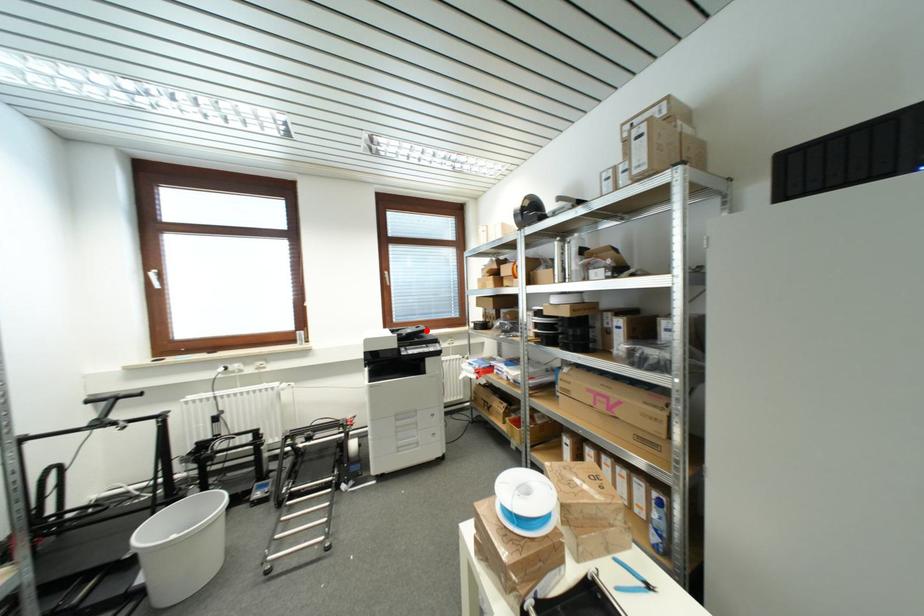
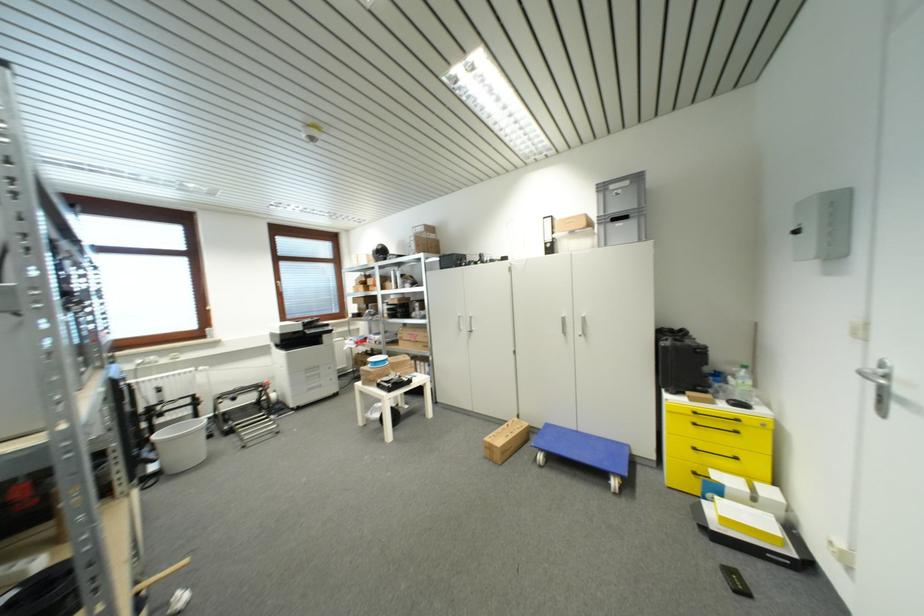
Where in the second image is the point corresponding to the highlighted location from the first image?

(320, 321)